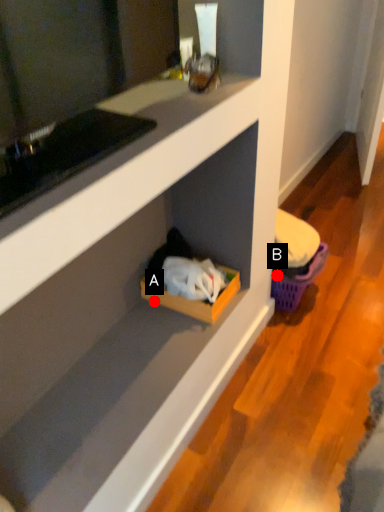
Question: Two points are circled on the image, labeled by A and B beside each circle. Which of the following is the closest to the observer?

Choices:
 (A) A is closer
 (B) B is closer

Answer: (A)